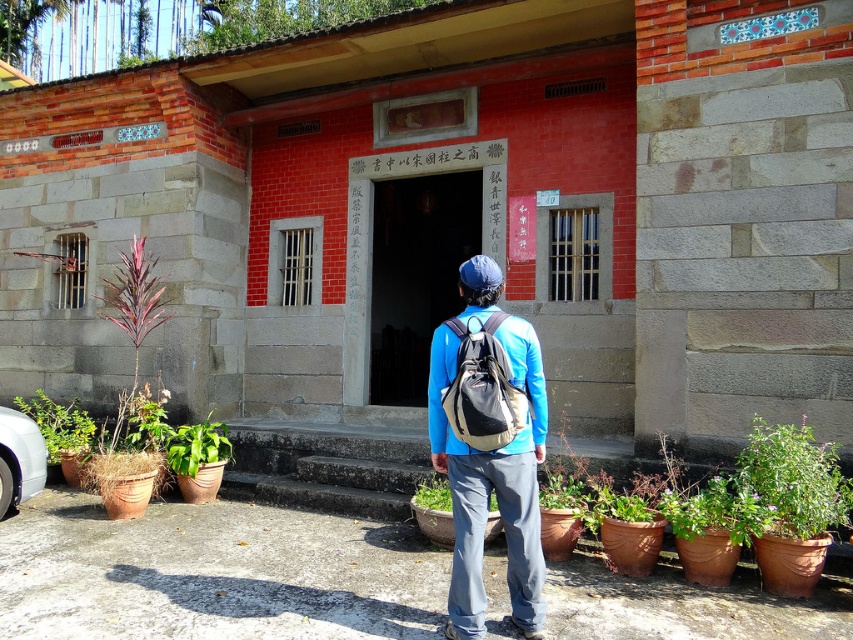
Does point (804, 468) come in front of point (486, 451)?

No, it is behind (486, 451).

At what (x,y) coordinates should I click in order to perform the action: click on green leafy plant at lower right. Please return your answer as a coordinate pair (x, y). The image size is (853, 640). Looking at the image, I should click on (795, 480).

Is blue fabric backpack at center positioned at the back of matte gray backpack at center?

Yes, blue fabric backpack at center is further from the viewer.

This screenshot has height=640, width=853. Describe the element at coordinates (489, 445) in the screenshot. I see `blue fabric backpack at center` at that location.

You are a GUI agent. You are given a task and a screenshot of the screen. Output one action in this format:
    pyautogui.click(x=<x>, y=<y>)
    Task: Click on the blue fabric backpack at center
    
    Given the screenshot: What is the action you would take?
    pyautogui.click(x=489, y=445)

Can you confirm if green leafy plant at lower right is taller than silver metallic car at lower left?

No.

Between point (809, 472) and point (25, 429), which one is positioned behind?

The point (25, 429) is behind.

Describe the element at coordinates (795, 480) in the screenshot. I see `green leafy plant at lower right` at that location.

The image size is (853, 640). Identify the location of green leafy plant at lower right. (795, 480).